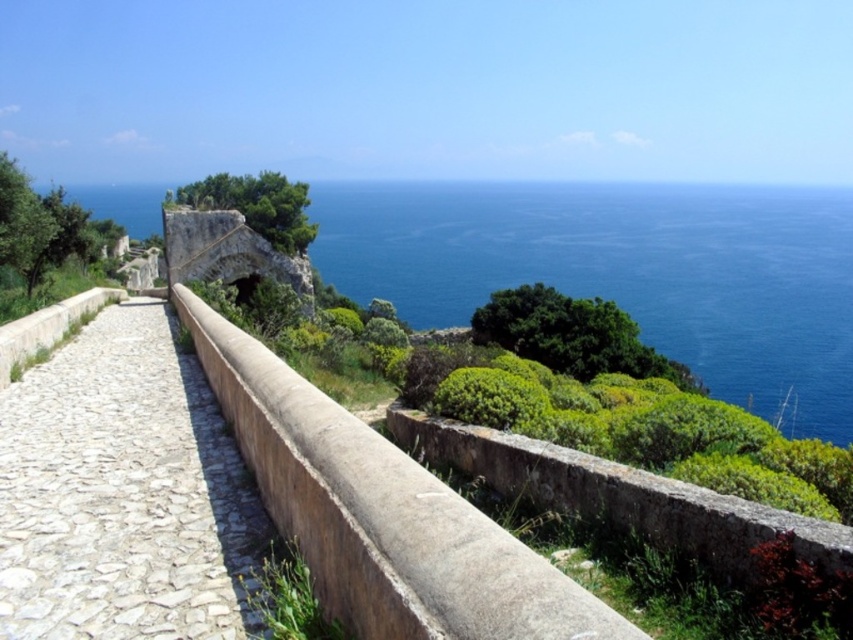
Measure the distance between point (343, 250) and camera.

Point (343, 250) and camera are 1736.65 feet apart.

Can you confirm if blue water at center is positioned above stone paved path at left?

Yes.

Which is in front, point (578, 234) or point (115, 580)?

Point (115, 580)

Where is `blue water at center`? blue water at center is located at coordinates (625, 269).

From the picture: Does stone paved path at left have a larger size compared to brown stone ledge at center?

No.

This screenshot has width=853, height=640. I want to click on stone paved path at left, so click(x=123, y=492).

Consider the image. Is blue water at center further to camera compared to brown stone ledge at center?

Yes, it is.

Based on the photo, between blue water at center and brown stone ledge at center, which one appears on the right side from the viewer's perspective?

Positioned to the right is blue water at center.

Find the location of a particular element. This screenshot has width=853, height=640. blue water at center is located at coordinates (625, 269).